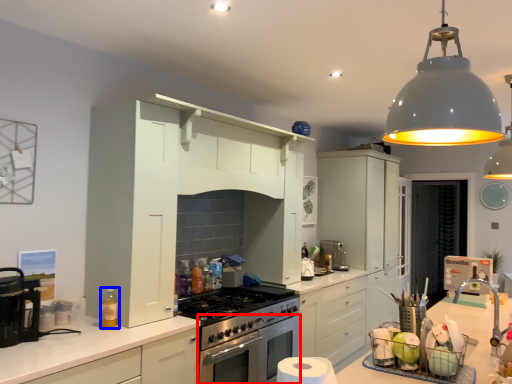
Question: Which of the following is the farthest to the observer, oven (highlighted by a red box) or bottle (highlighted by a blue box)?

Choices:
 (A) oven
 (B) bottle

Answer: (A)